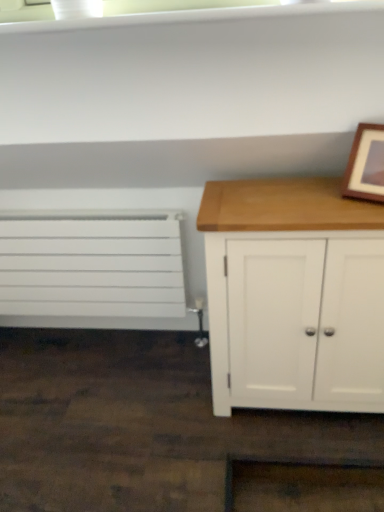
Where is `free space to the left of wooden picture frame at upper right`? free space to the left of wooden picture frame at upper right is located at coordinates (327, 206).